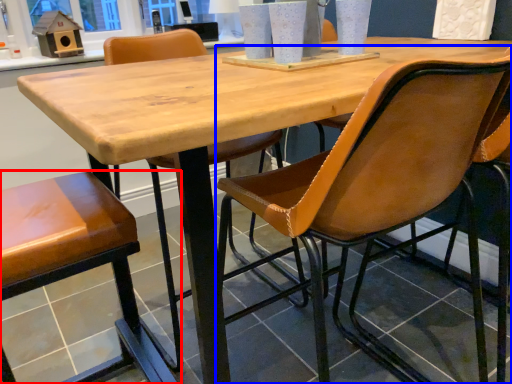
Question: Which point is closer to the camera, chair (highlighted by a red box) or chair (highlighted by a blue box)?

Choices:
 (A) chair
 (B) chair

Answer: (B)